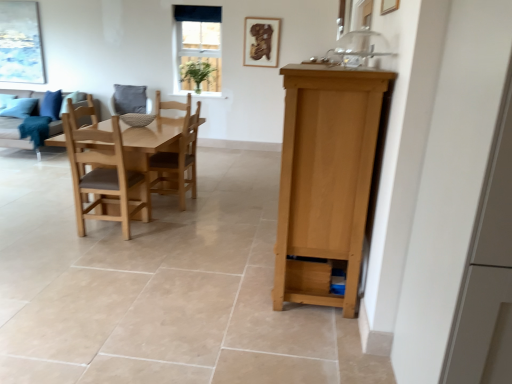
Question: Can you confirm if white glass window at upper center is wider than light brown wooden table at center?

Choices:
 (A) no
 (B) yes

Answer: (A)

Question: Is white glass window at upper center facing towards light brown wooden table at center?

Choices:
 (A) no
 (B) yes

Answer: (B)

Question: Would you say white glass window at upper center is a long distance from light brown wooden table at center?

Choices:
 (A) no
 (B) yes

Answer: (B)

Question: Considering the relative positions of white glass window at upper center and light brown wooden table at center in the image provided, is white glass window at upper center to the right of light brown wooden table at center from the viewer's perspective?

Choices:
 (A) no
 (B) yes

Answer: (B)

Question: Does white glass window at upper center have a larger size compared to light brown wooden table at center?

Choices:
 (A) yes
 (B) no

Answer: (B)

Question: From the image's perspective, is light brown wooden table at center above or below white glass window at upper center?

Choices:
 (A) above
 (B) below

Answer: (B)

Question: Is light brown wooden table at center taller or shorter than white glass window at upper center?

Choices:
 (A) tall
 (B) short

Answer: (B)

Question: From a real-world perspective, is light brown wooden table at center above or below white glass window at upper center?

Choices:
 (A) below
 (B) above

Answer: (A)

Question: Is light brown wooden table at center wider or thinner than white glass window at upper center?

Choices:
 (A) thin
 (B) wide

Answer: (B)

Question: Considering the positions of point (280, 273) and point (9, 34), is point (280, 273) closer or farther from the camera than point (9, 34)?

Choices:
 (A) farther
 (B) closer

Answer: (B)

Question: Relative to matte blue painting at upper left, which is the 1th picture frame from left to right, is light brown wood cabinet at right in front or behind?

Choices:
 (A) front
 (B) behind

Answer: (A)

Question: Considering the positions of light brown wood cabinet at right and matte blue painting at upper left, marked as the 1th picture frame in a back-to-front arrangement, in the image, is light brown wood cabinet at right wider or thinner than matte blue painting at upper left, marked as the 1th picture frame in a back-to-front arrangement,?

Choices:
 (A) thin
 (B) wide

Answer: (B)

Question: From the image's perspective, is light brown wood cabinet at right located above or below matte blue painting at upper left, which is the 1th picture frame from left to right?

Choices:
 (A) below
 (B) above

Answer: (A)

Question: Looking at their shapes, would you say matte gray fabric couch at left is wider or thinner than light brown wooden table at center?

Choices:
 (A) thin
 (B) wide

Answer: (B)

Question: In the image, is matte gray fabric couch at left on the left side or the right side of light brown wooden table at center?

Choices:
 (A) left
 (B) right

Answer: (A)